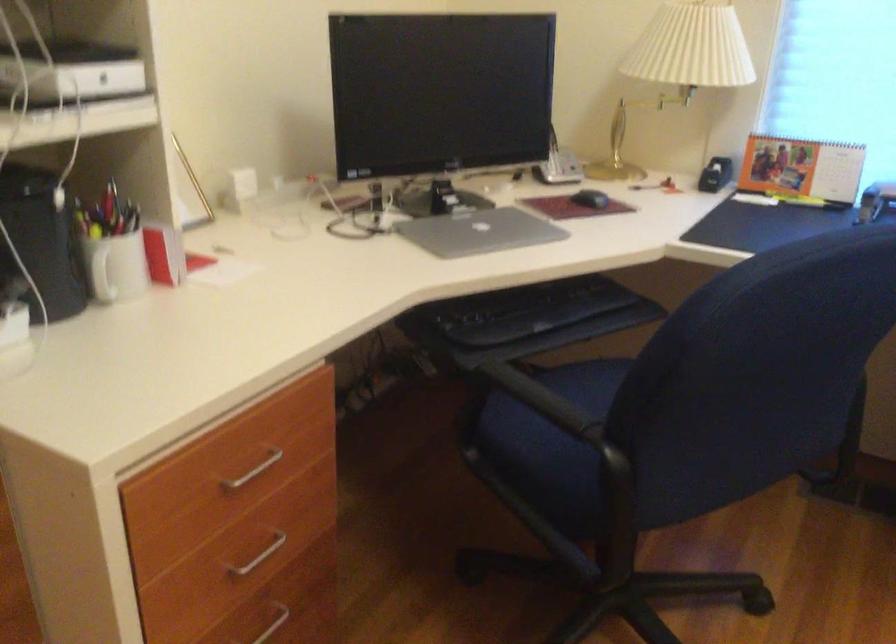
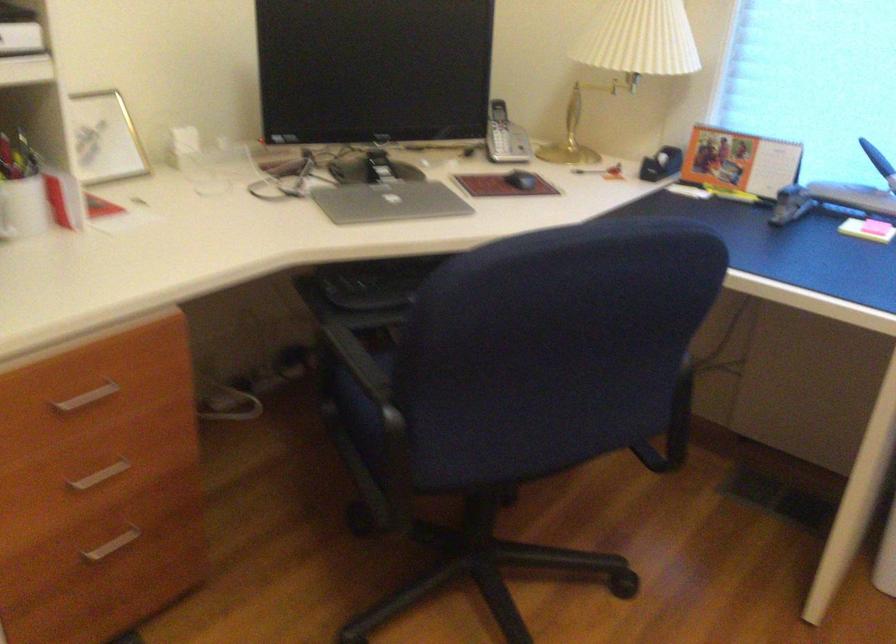
Find the pixel in the second image that matches the point at 556,156 in the first image.

(504, 136)